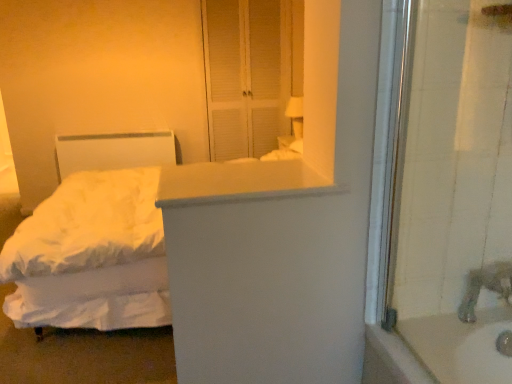
Question: Should I look upward or downward to see silver metallic faucet at lower right?

Choices:
 (A) down
 (B) up

Answer: (A)

Question: Does white matte screen door at upper center appear on the left side of white soft bed at left?

Choices:
 (A) no
 (B) yes

Answer: (A)

Question: Is white matte screen door at upper center not within white soft bed at left?

Choices:
 (A) no
 (B) yes

Answer: (B)

Question: Can you confirm if white matte screen door at upper center is thinner than white soft bed at left?

Choices:
 (A) yes
 (B) no

Answer: (A)

Question: Is white matte screen door at upper center shorter than white soft bed at left?

Choices:
 (A) no
 (B) yes

Answer: (A)

Question: Does white matte screen door at upper center have a greater height compared to white soft bed at left?

Choices:
 (A) yes
 (B) no

Answer: (A)

Question: From the image's perspective, is white matte screen door at upper center on top of white soft bed at left?

Choices:
 (A) yes
 (B) no

Answer: (A)

Question: Can you confirm if white matte counter top at center is smaller than white soft bed at left?

Choices:
 (A) no
 (B) yes

Answer: (B)

Question: Considering the relative sizes of white matte counter top at center and white soft bed at left in the image provided, is white matte counter top at center thinner than white soft bed at left?

Choices:
 (A) no
 (B) yes

Answer: (B)

Question: From a real-world perspective, is white matte counter top at center on top of white soft bed at left?

Choices:
 (A) yes
 (B) no

Answer: (A)

Question: Is white matte counter top at center oriented towards white soft bed at left?

Choices:
 (A) yes
 (B) no

Answer: (B)

Question: Can you confirm if white matte counter top at center is wider than white soft bed at left?

Choices:
 (A) no
 (B) yes

Answer: (A)

Question: Considering the relative sizes of white matte counter top at center and white soft bed at left in the image provided, is white matte counter top at center bigger than white soft bed at left?

Choices:
 (A) no
 (B) yes

Answer: (A)

Question: Is white matte counter top at center outside white matte screen door at upper center?

Choices:
 (A) no
 (B) yes

Answer: (B)